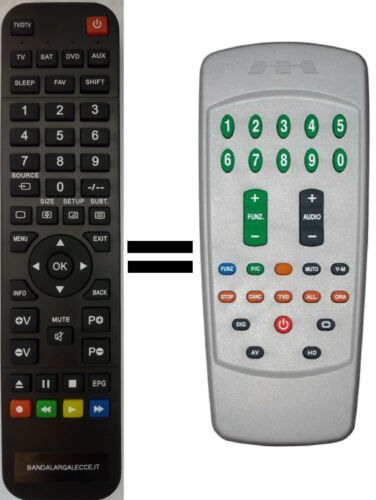
Where is `corner of black remote`? This screenshot has height=500, width=376. corner of black remote is located at coordinates (114, 492), (9, 492), (9, 8), (109, 6).